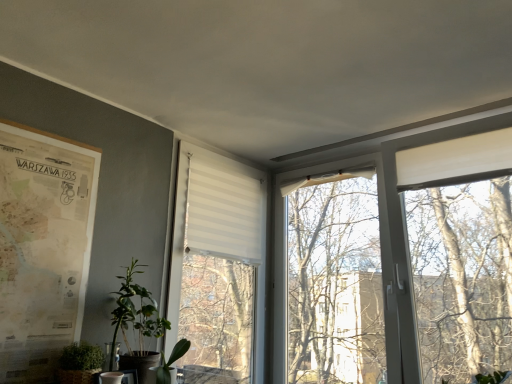
Question: Is green matte plant at lower left, placed as the 2th houseplant when sorted from right to left, to the right of white striped fabric at center from the viewer's perspective?

Choices:
 (A) no
 (B) yes

Answer: (A)

Question: Is green matte plant at lower left, placed as the 2th houseplant when sorted from right to left, wider than white striped fabric at center?

Choices:
 (A) no
 (B) yes

Answer: (B)

Question: From the image's perspective, is green matte plant at lower left, placed as the second houseplant when sorted from left to right, located above white striped fabric at center?

Choices:
 (A) no
 (B) yes

Answer: (A)

Question: Is green matte plant at lower left, placed as the 2th houseplant when sorted from right to left, taller than white striped fabric at center?

Choices:
 (A) yes
 (B) no

Answer: (B)

Question: Can you confirm if green matte plant at lower left, placed as the 2th houseplant when sorted from right to left, is shorter than white striped fabric at center?

Choices:
 (A) yes
 (B) no

Answer: (A)

Question: Is white striped fabric at center a part of green matte plant at lower left, placed as the second houseplant when sorted from left to right?

Choices:
 (A) yes
 (B) no

Answer: (B)

Question: Does white striped fabric at center lie behind green matte plant at lower left, placed as the second houseplant when sorted from left to right?

Choices:
 (A) no
 (B) yes

Answer: (B)

Question: From a real-world perspective, is white striped fabric at center located higher than green matte plant at lower left, placed as the second houseplant when sorted from left to right?

Choices:
 (A) no
 (B) yes

Answer: (B)

Question: Is green matte plant at lower left, placed as the 2th houseplant when sorted from right to left, inside white striped fabric at center?

Choices:
 (A) no
 (B) yes

Answer: (A)

Question: Does white striped fabric at center have a lesser width compared to green matte plant at lower left, placed as the 2th houseplant when sorted from right to left?

Choices:
 (A) no
 (B) yes

Answer: (B)

Question: Can you confirm if white striped fabric at center is smaller than green matte plant at lower left, placed as the second houseplant when sorted from left to right?

Choices:
 (A) yes
 (B) no

Answer: (B)

Question: From the image's perspective, is white striped fabric at center above green matte plant at lower left, placed as the second houseplant when sorted from left to right?

Choices:
 (A) yes
 (B) no

Answer: (A)

Question: Can you confirm if green matte plant at lower center, acting as the 3th houseplant starting from the left, is positioned to the right of beige paper map at left?

Choices:
 (A) no
 (B) yes

Answer: (B)